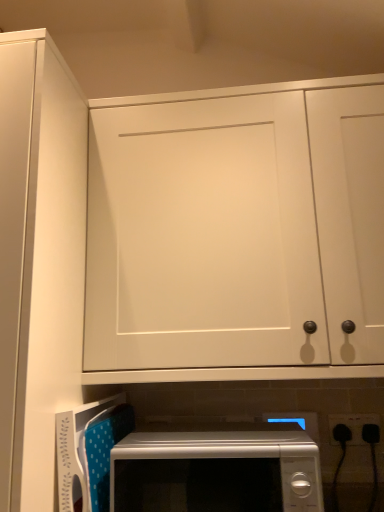
Question: Is black plastic electrical outlet at lower right completely or partially outside of white plastic microwave at lower center?

Choices:
 (A) no
 (B) yes

Answer: (B)

Question: From the image's perspective, is black plastic electrical outlet at lower right under white plastic microwave at lower center?

Choices:
 (A) no
 (B) yes

Answer: (A)

Question: Can you confirm if black plastic electrical outlet at lower right is wider than white plastic microwave at lower center?

Choices:
 (A) yes
 (B) no

Answer: (B)

Question: Can you confirm if black plastic electrical outlet at lower right is bigger than white plastic microwave at lower center?

Choices:
 (A) yes
 (B) no

Answer: (B)

Question: Does black plastic electrical outlet at lower right turn towards white plastic microwave at lower center?

Choices:
 (A) yes
 (B) no

Answer: (B)

Question: Does black plastic electrical outlet at lower right come behind white plastic microwave at lower center?

Choices:
 (A) no
 (B) yes

Answer: (B)

Question: Is white matte cabinet door at upper left, the 1th door from the left, aimed at white matte cabinet door at upper center, which appears as the first door when viewed from the right?

Choices:
 (A) yes
 (B) no

Answer: (B)

Question: Is white matte cabinet door at upper left, arranged as the 2th door when viewed from the right, shorter than white matte cabinet door at upper center, which appears as the first door when viewed from the right?

Choices:
 (A) no
 (B) yes

Answer: (A)

Question: Does white matte cabinet door at upper left, the 1th door from the left, have a greater width compared to white matte cabinet door at upper center, which appears as the first door when viewed from the right?

Choices:
 (A) yes
 (B) no

Answer: (A)

Question: Does white matte cabinet door at upper left, the 1th door from the left, appear on the right side of white matte cabinet door at upper center, which appears as the first door when viewed from the right?

Choices:
 (A) no
 (B) yes

Answer: (A)

Question: Can you confirm if white matte cabinet door at upper left, arranged as the 2th door when viewed from the right, is bigger than white matte cabinet door at upper center, positioned as the second door in left-to-right order?

Choices:
 (A) yes
 (B) no

Answer: (A)

Question: Is the position of white matte cabinet door at upper left, arranged as the 2th door when viewed from the right, less distant than that of white matte cabinet door at upper center, which appears as the first door when viewed from the right?

Choices:
 (A) no
 (B) yes

Answer: (B)

Question: Is white glossy microwave at lower center closer to the viewer compared to black plastic electrical outlet at lower right?

Choices:
 (A) no
 (B) yes

Answer: (B)